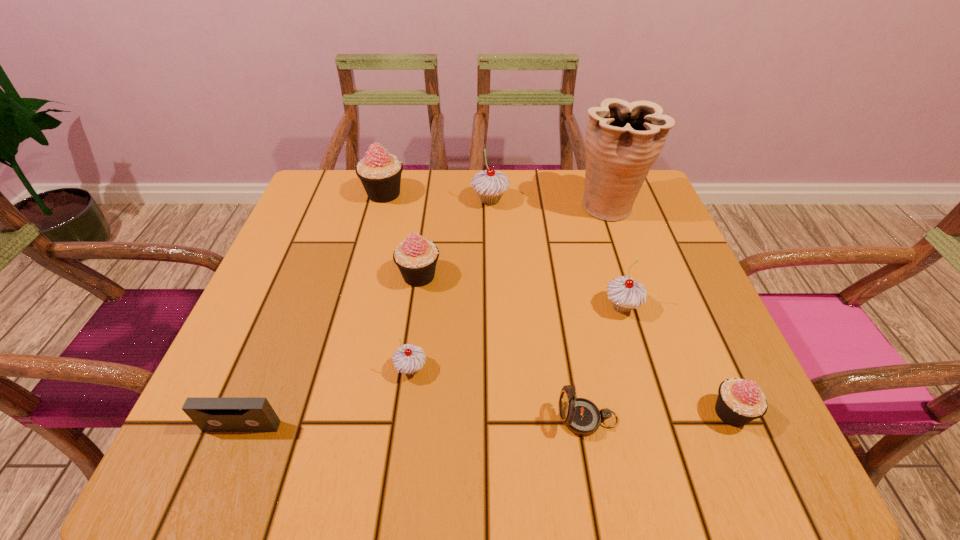
Identify which pink cupcake is the second closest to the fourth nearest cupcake. Please provide its 2D coordinates. Your answer should be formatted as a tuple, i.e. [(x, y)], where the tuple contains the x and y coordinates of a point satisfying the conditions above.

[(739, 401)]

Find the location of a particular element. pink cupcake that is the closest to the shortest object is located at coordinates (416, 257).

Find the location of `vacant space that satisfies the following two spatial constraints: 1. on the front side of the rightmost cupcake; 2. on the left side of the tallest object`. vacant space that satisfies the following two spatial constraints: 1. on the front side of the rightmost cupcake; 2. on the left side of the tallest object is located at coordinates (679, 413).